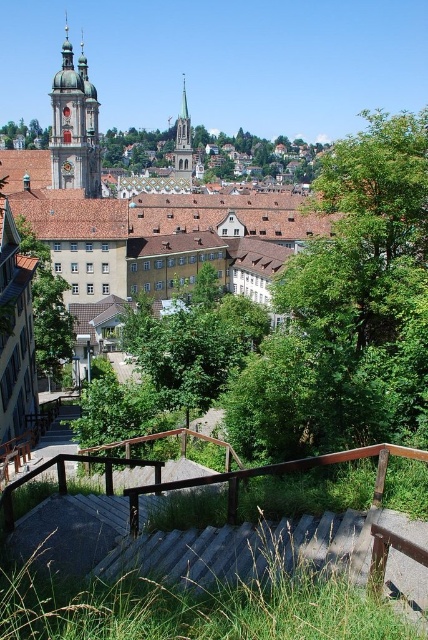
You are standing at the top of the wooden stairs and want to walk down to the town square. As you look down the stairs, which green leafy tree do you see first? The green leafy tree at center or the green leafy tree at upper center?

The green leafy tree at upper center is seen first because it is positioned higher up, above the green leafy tree at center.

You are standing at the top of the wooden stairs in the historic town scene. You notice two points marked in the image. Which point, point (38, 298) or point (8, 132), is closer to you as you look down the stairs?

Point (38, 298) is closer to the viewer than point (8, 132).

Consider the image. You are a tourist standing at the bottom of the stairs and want to take a photo of the green stone church steeple at center. However, you notice the brown wooden rail at lower center might block your view. Based on their heights, can you still see the steeple clearly?

The brown wooden rail at lower center is not as tall as the green stone church steeple at center, so you can still see the steeple clearly over the rail.